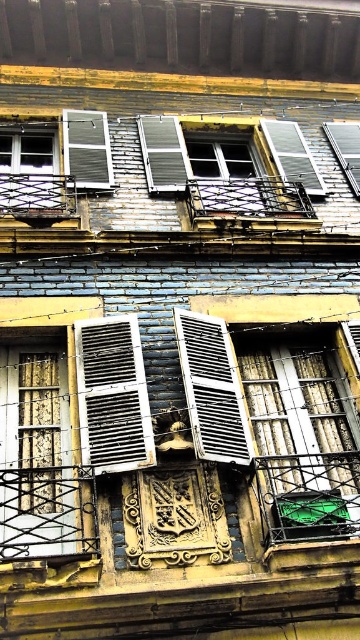
Question: Which point is closer to the camera?

Choices:
 (A) transparent glass window at upper right
 (B) wooden textured shutter at left

Answer: (B)

Question: Does matte white window at upper left have a lesser width compared to metallic silver shutters at upper center?

Choices:
 (A) no
 (B) yes

Answer: (B)

Question: Which object is positioned closest to the transparent glass window at upper right?

Choices:
 (A) white matte shutter at center
 (B) wooden textured shutter at left
 (C) metallic silver shutters at upper center
 (D) matte white window at center

Answer: (C)

Question: Considering the relative positions of wooden shutters at center and metallic silver shutters at upper center in the image provided, where is wooden shutters at center located with respect to metallic silver shutters at upper center?

Choices:
 (A) left
 (B) right

Answer: (A)

Question: Is metallic silver shutters at upper center in front of transparent glass window at upper right?

Choices:
 (A) no
 (B) yes

Answer: (B)

Question: Estimate the real-world distances between objects in this image. Which object is farther from the matte white window at upper left?

Choices:
 (A) wooden shutters at center
 (B) matte white window at center
 (C) metallic silver shutters at upper center

Answer: (C)